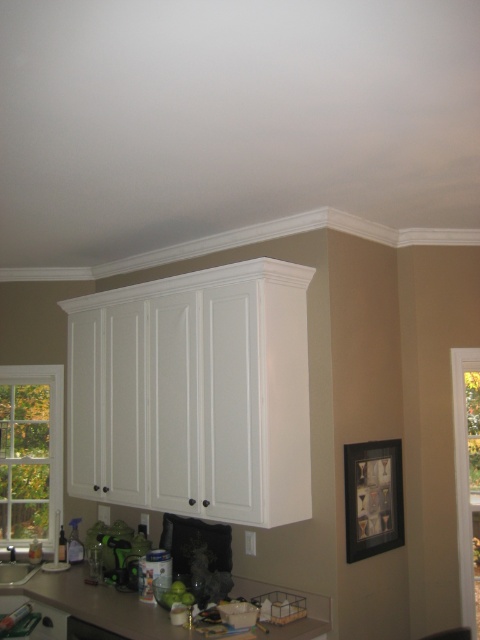
Can you confirm if clear glass window at left is wider than clear glass window at upper left?

Yes.

Is clear glass window at left above clear glass window at upper left?

Correct, clear glass window at left is located above clear glass window at upper left.

At what (x,y) coordinates should I click in order to perform the action: click on clear glass window at left. Please return your answer as a coordinate pair (x, y). This screenshot has width=480, height=640. Looking at the image, I should click on (29, 452).

The height and width of the screenshot is (640, 480). In order to click on clear glass window at left in this screenshot , I will do `click(29, 452)`.

Is clear glass window at left taller than white glossy sink at lower center?

Correct, clear glass window at left is much taller as white glossy sink at lower center.

Which of these two, clear glass window at left or white glossy sink at lower center, stands shorter?

white glossy sink at lower center is shorter.

Is point (12, 504) farther from viewer compared to point (15, 568)?

Yes, it is behind point (15, 568).

The height and width of the screenshot is (640, 480). In order to click on clear glass window at left in this screenshot , I will do coord(29,452).

Which is above, matte brown countertop at lower center or clear glass window at upper left?

clear glass window at upper left is higher up.

Describe the element at coordinates (97, 604) in the screenshot. I see `matte brown countertop at lower center` at that location.

Identify the location of matte brown countertop at lower center. (97, 604).